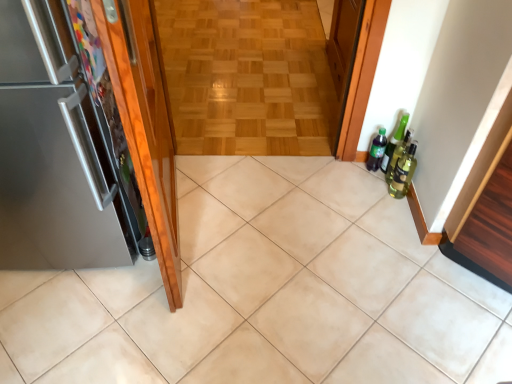
This screenshot has height=384, width=512. What are the coordinates of `vacant space that's between satin metallic refrigerator at left, the 1th door in the left-to-right sequence, and green glass beer bottle at right, the first beer bottle positioned from the back` in the screenshot? It's located at (263, 197).